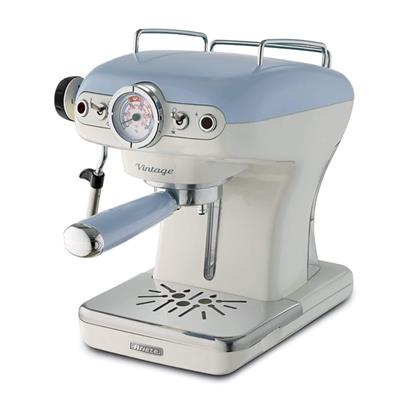
Find the location of a particular element. The height and width of the screenshot is (416, 416). frother is located at coordinates (137, 217).